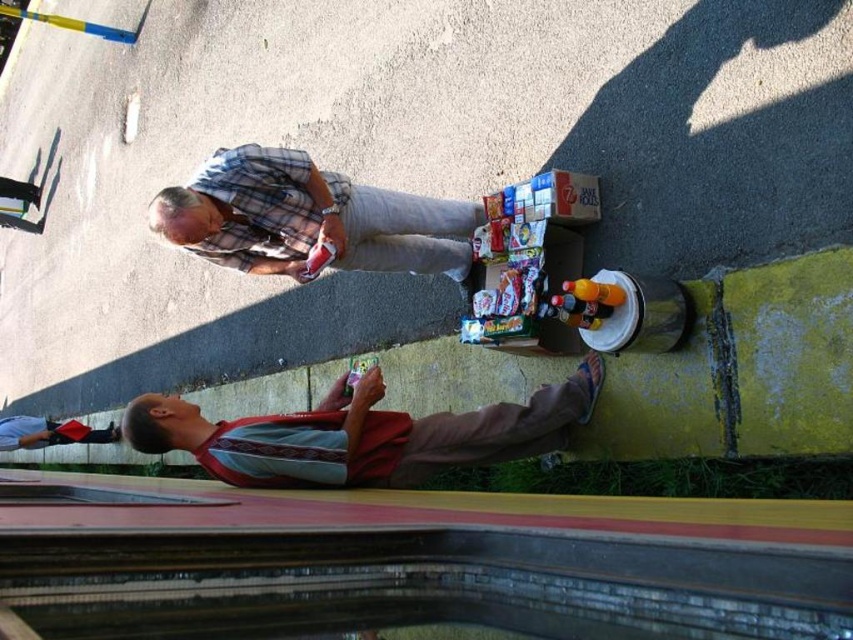
Between plaid shirt at center and red fabric shirt at lower left, which one has less height?

With less height is red fabric shirt at lower left.

In the scene shown: Who is positioned more to the left, plaid shirt at center or red fabric shirt at lower left?

Positioned to the left is red fabric shirt at lower left.

The width and height of the screenshot is (853, 640). What do you see at coordinates (308, 218) in the screenshot? I see `plaid shirt at center` at bounding box center [308, 218].

You are a GUI agent. You are given a task and a screenshot of the screen. Output one action in this format:
    pyautogui.click(x=<x>, y=<y>)
    Task: Click on the plaid shirt at center
    This screenshot has width=853, height=640.
    Given the screenshot: What is the action you would take?
    pyautogui.click(x=308, y=218)

Can you confirm if reddish-brown fabric shirt at lower left is shorter than plaid shirt at center?

Yes.

Between point (363, 406) and point (236, 180), which one is positioned behind?

Positioned behind is point (236, 180).

Does point (531, 428) come behind point (277, 225)?

No, (531, 428) is in front of (277, 225).

I want to click on reddish-brown fabric shirt at lower left, so click(361, 435).

Is reddish-brown fabric shirt at lower left thinner than red fabric shirt at lower left?

Yes, reddish-brown fabric shirt at lower left is thinner than red fabric shirt at lower left.

Consider the image. Does reddish-brown fabric shirt at lower left appear on the left side of red fabric shirt at lower left?

No, reddish-brown fabric shirt at lower left is not to the left of red fabric shirt at lower left.

Find the location of a particular element. The image size is (853, 640). reddish-brown fabric shirt at lower left is located at coordinates (361, 435).

You are a GUI agent. You are given a task and a screenshot of the screen. Output one action in this format:
    pyautogui.click(x=<x>, y=<y>)
    Task: Click on the reddish-brown fabric shirt at lower left
    
    Given the screenshot: What is the action you would take?
    pyautogui.click(x=361, y=435)